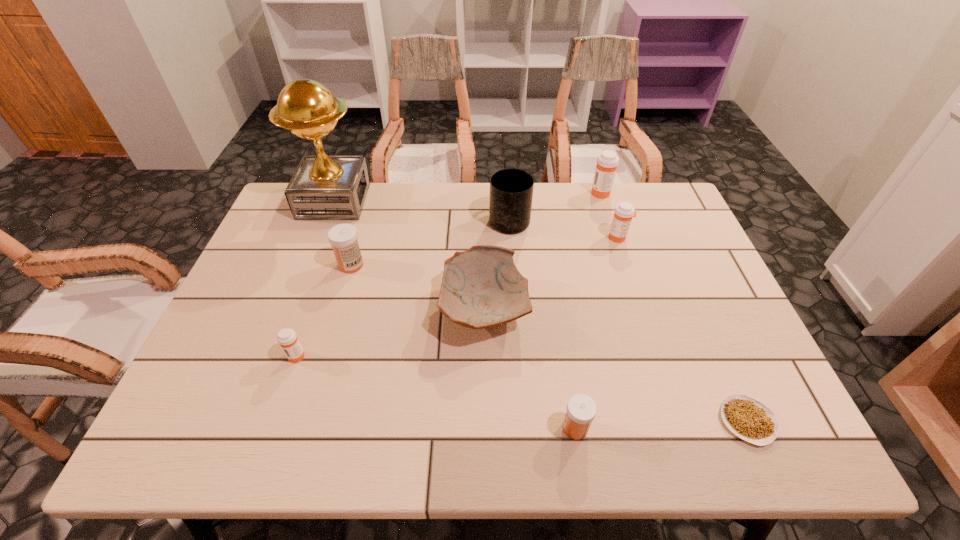
Find the location of `gold award`. gold award is located at coordinates (324, 187).

Identify the location of award. (324, 187).

The height and width of the screenshot is (540, 960). I want to click on mug, so click(511, 190).

Where is `the farthest medicine`? The width and height of the screenshot is (960, 540). the farthest medicine is located at coordinates (607, 162).

At what (x,y) coordinates should I click in order to perform the action: click on the tallest medicine. Please return your answer as a coordinate pair (x, y). The image size is (960, 540). Looking at the image, I should click on (607, 162).

Locate an element on the screen. This screenshot has width=960, height=540. the second farthest medicine is located at coordinates (622, 218).

In order to click on the second smallest orange medicine in this screenshot , I will do `click(622, 218)`.

The image size is (960, 540). What are the coordinates of `the third farthest medicine` in the screenshot? It's located at click(343, 237).

You are a GUI agent. You are given a task and a screenshot of the screen. Output one action in this format:
    pyautogui.click(x=<x>, y=<y>)
    Task: Click on the left white medicine
    
    Given the screenshot: What is the action you would take?
    pyautogui.click(x=343, y=237)

This screenshot has height=540, width=960. Find the location of `pottery`. pottery is located at coordinates (481, 287).